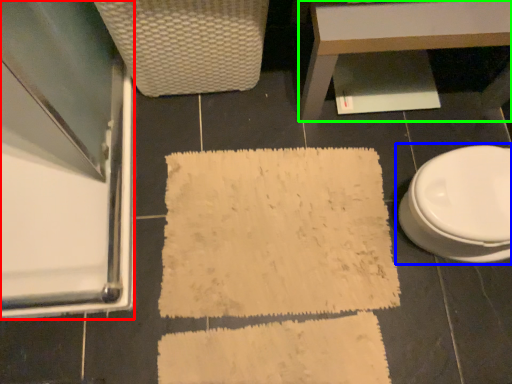
Question: Estimate the real-world distances between objects in this image. Which object is farther from screen door (highlighted by a red box), toilet (highlighted by a blue box) or table (highlighted by a green box)?

Choices:
 (A) toilet
 (B) table

Answer: (A)